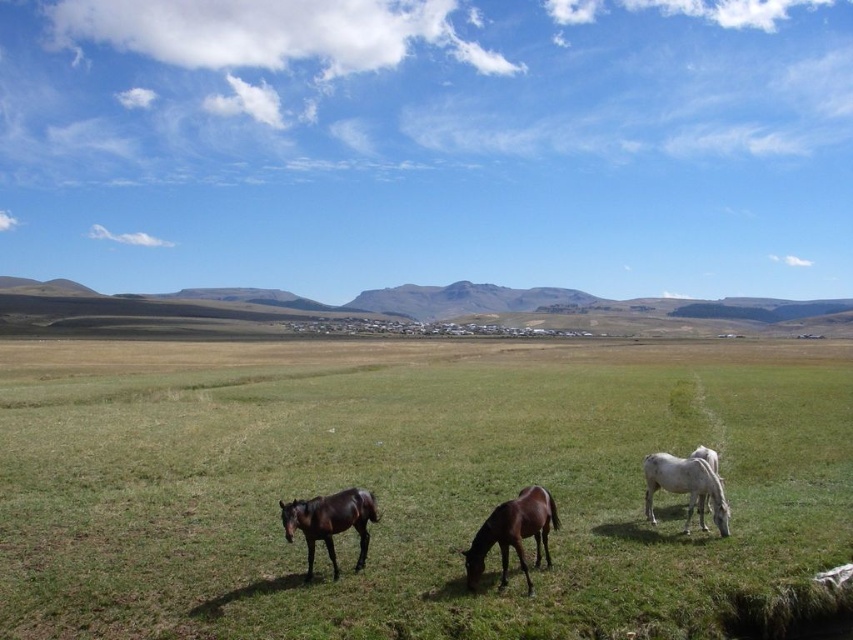
You are standing at the point labeled as point (514, 532) in the image. Looking around, you see the brown glossy horse at center and the white horse on the left. Which horse is closer to your current position?

The brown glossy horse at center is closer to your current position because the point (514, 532) corresponds to the brown glossy horse at center.

You are a photographer planning to capture a wide landscape shot of the green grass pasture at center and the shiny brown horse at lower left. Given that the pasture is larger than the horse, how might you frame your shot to ensure both elements are clearly visible?

Since the green grass pasture at center is larger than the shiny brown horse at lower left, you should position the camera to focus on the pasture while ensuring the horse is still within the frame. This way, both elements will be clearly visible.